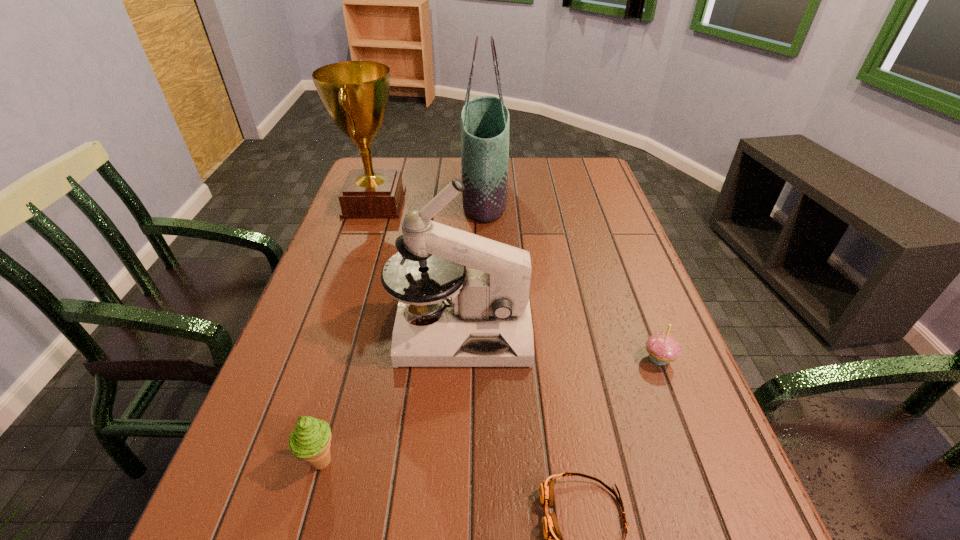
Locate an element on the screen. vacant space located on the front of the rightmost object is located at coordinates (727, 536).

Where is `tote bag that is at the far edge`? tote bag that is at the far edge is located at coordinates (485, 121).

You are a GUI agent. You are given a task and a screenshot of the screen. Output one action in this format:
    pyautogui.click(x=<x>, y=<y>)
    Task: Click on the award that is at the far edge
    This screenshot has width=960, height=540.
    Given the screenshot: What is the action you would take?
    pyautogui.click(x=355, y=93)

The image size is (960, 540). I want to click on award that is at the left edge, so click(x=355, y=93).

Where is `icecream present at the left edge`? Image resolution: width=960 pixels, height=540 pixels. icecream present at the left edge is located at coordinates (310, 440).

You are a GUI agent. You are given a task and a screenshot of the screen. Output one action in this format:
    pyautogui.click(x=<x>, y=<y>)
    Task: Click on the object that is at the right edge
    
    Given the screenshot: What is the action you would take?
    pyautogui.click(x=662, y=348)

In order to click on object that is at the far left corner in this screenshot , I will do `click(355, 93)`.

The image size is (960, 540). In the image, there is a desktop. Find the location of `free space at the left edge`. free space at the left edge is located at coordinates pyautogui.click(x=376, y=228).

Find the location of `vacant space at the right edge of the desktop`. vacant space at the right edge of the desktop is located at coordinates (597, 253).

In the image, there is a desktop. Find the location of `vacant space at the far left corner`. vacant space at the far left corner is located at coordinates (399, 161).